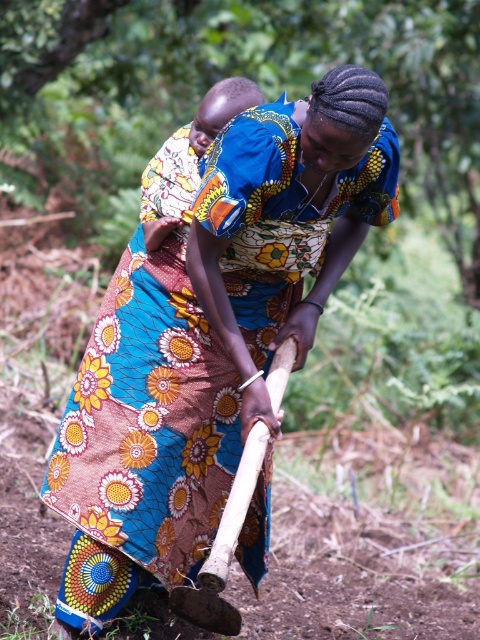
Question: Which of the following is the closest to the observer?

Choices:
 (A) wooden shovel at center
 (B) wooden hoe at center

Answer: (B)

Question: In this image, where is wooden hoe at center located relative to wooden shovel at center?

Choices:
 (A) left
 (B) right

Answer: (A)

Question: From the image, what is the correct spatial relationship of wooden hoe at center in relation to wooden shovel at center?

Choices:
 (A) right
 (B) left

Answer: (B)

Question: Which of the following is the farthest from the observer?

Choices:
 (A) (132, 557)
 (B) (238, 468)

Answer: (A)

Question: Where is wooden hoe at center located in relation to wooden shovel at center in the image?

Choices:
 (A) above
 (B) below

Answer: (A)